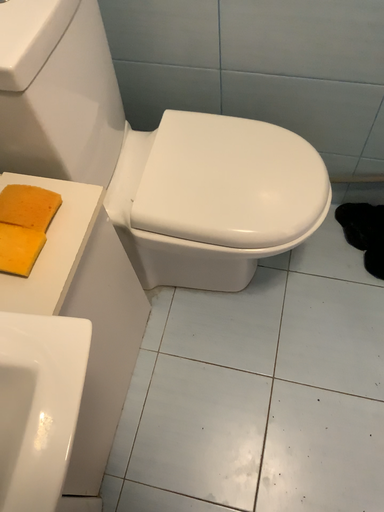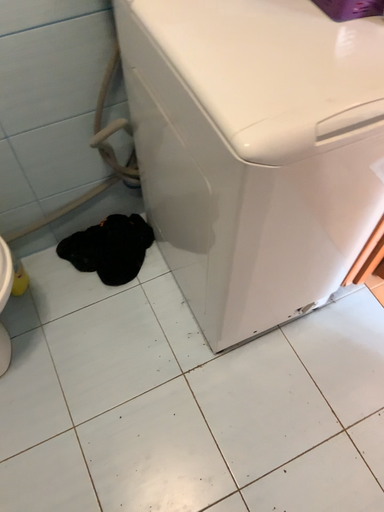
Question: How did the camera likely rotate when shooting the video?

Choices:
 (A) rotated left
 (B) rotated right

Answer: (B)